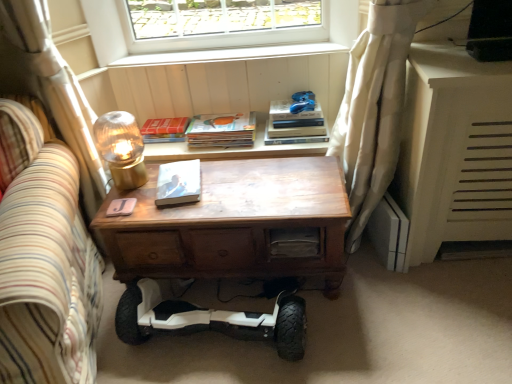
Find the location of a particular element. The height and width of the screenshot is (384, 512). vacant point above wooden desk at center (from a real-world perspective) is located at coordinates (236, 185).